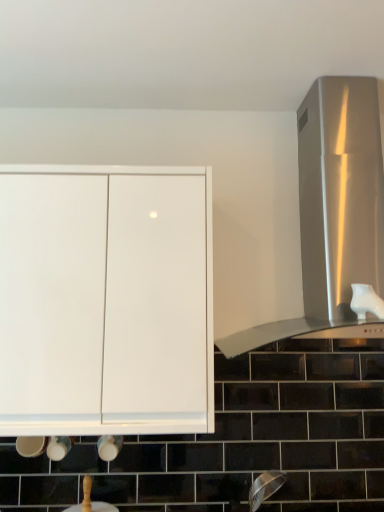
What do you see at coordinates (106, 300) in the screenshot?
I see `white glossy cabinet at upper left` at bounding box center [106, 300].

The width and height of the screenshot is (384, 512). Describe the element at coordinates (333, 209) in the screenshot. I see `stainless steel vent at right` at that location.

This screenshot has height=512, width=384. I want to click on white glossy sink at lower center, so click(90, 501).

Is white glossy sink at lower center touching white glossy cabinet at upper left?

No, white glossy sink at lower center is not next to white glossy cabinet at upper left.

Where is `sink on the right of white glossy cabinet at upper left`? sink on the right of white glossy cabinet at upper left is located at coordinates (90, 501).

Does white glossy sink at lower center have a greater height compared to white glossy cabinet at upper left?

No.

From the image's perspective, which is above, white glossy sink at lower center or white glossy cabinet at upper left?

white glossy cabinet at upper left, from the image's perspective.

Looking at this image, does stainless steel vent at right touch white glossy cabinet at upper left?

stainless steel vent at right and white glossy cabinet at upper left are clearly separated.

Identify the location of cabinetry below the stainless steel vent at right (from a real-world perspective). (106, 300).

Is point (282, 329) positioned behind point (120, 210)?

Yes, it is behind point (120, 210).

In the scene shown: Considering the relative sizes of stainless steel vent at right and white glossy cabinet at upper left in the image provided, is stainless steel vent at right taller than white glossy cabinet at upper left?

Yes.

Measure the distance from white glossy cabinet at upper left to stainless steel vent at right.

55.59 centimeters.

Is white glossy cabinet at upper left in contact with stainless steel vent at right?

white glossy cabinet at upper left and stainless steel vent at right are not in contact.

From a real-world perspective, is white glossy cabinet at upper left under stainless steel vent at right?

Yes, from a real-world perspective, white glossy cabinet at upper left is under stainless steel vent at right.

Between white glossy cabinet at upper left and stainless steel vent at right, which one is positioned behind?

stainless steel vent at right is further from the camera.

What's the angular difference between stainless steel vent at right and white glossy sink at lower center's facing directions?

The angle between the facing direction of stainless steel vent at right and the facing direction of white glossy sink at lower center is 3.52 degrees.

Does point (341, 106) come farther from viewer compared to point (83, 499)?

No, (341, 106) is closer to viewer.

How far apart are stainless steel vent at right and white glossy sink at lower center?

stainless steel vent at right is 3.89 feet away from white glossy sink at lower center.

From a real-world perspective, is stainless steel vent at right positioned over white glossy sink at lower center based on gravity?

Yes, from a real-world perspective, stainless steel vent at right is above white glossy sink at lower center.

From a real-world perspective, is white glossy cabinet at upper left located beneath white glossy sink at lower center?

No, from a real-world perspective, white glossy cabinet at upper left is not beneath white glossy sink at lower center.

From the image's perspective, is white glossy cabinet at upper left above or below white glossy sink at lower center?

white glossy cabinet at upper left is above white glossy sink at lower center.

Between point (94, 378) and point (90, 496), which one is positioned behind?

The point (90, 496) is more distant.

Is white glossy cabinet at upper left positioned beyond the bounds of white glossy sink at lower center?

Absolutely, white glossy cabinet at upper left is external to white glossy sink at lower center.

Between white glossy sink at lower center and stainless steel vent at right, which one has more height?

stainless steel vent at right is taller.

Is white glossy sink at lower center not within stainless steel vent at right?

Yes, white glossy sink at lower center is located beyond the bounds of stainless steel vent at right.

Does white glossy sink at lower center come in front of stainless steel vent at right?

No, white glossy sink at lower center is further to the viewer.

Are white glossy sink at lower center and stainless steel vent at right located far from each other?

Indeed, white glossy sink at lower center is not near stainless steel vent at right.

Locate an element on the screen. The width and height of the screenshot is (384, 512). cabinetry that appears on the left of white glossy sink at lower center is located at coordinates (106, 300).

At what (x,y) coordinates should I click in order to perform the action: click on cabinetry in front of the stainless steel vent at right. Please return your answer as a coordinate pair (x, y). Looking at the image, I should click on (106, 300).

Estimate the real-world distances between objects in this image. Which object is further from white glossy sink at lower center, white glossy cabinet at upper left or stainless steel vent at right?

stainless steel vent at right lies further to white glossy sink at lower center than the other object.

From the image, which object appears to be nearer to white glossy cabinet at upper left, white glossy sink at lower center or stainless steel vent at right?

stainless steel vent at right is positioned closer to the anchor white glossy cabinet at upper left.

Estimate the real-world distances between objects in this image. Which object is closer to white glossy sink at lower center, stainless steel vent at right or white glossy cabinet at upper left?

A: white glossy cabinet at upper left lies closer to white glossy sink at lower center than the other object.

Based on their spatial positions, is white glossy cabinet at upper left or white glossy sink at lower center further from stainless steel vent at right?

Among the two, white glossy sink at lower center is located further to stainless steel vent at right.

When comparing their distances from white glossy cabinet at upper left, does stainless steel vent at right or white glossy sink at lower center seem closer?

stainless steel vent at right.

Estimate the real-world distances between objects in this image. Which object is closer to stainless steel vent at right, white glossy sink at lower center or white glossy cabinet at upper left?

white glossy cabinet at upper left lies closer to stainless steel vent at right than the other object.

You are a GUI agent. You are given a task and a screenshot of the screen. Output one action in this format:
    pyautogui.click(x=<x>, y=<y>)
    Task: Click on the cabinetry between stainless steel vent at right and white glossy sink at lower center from top to bottom
    
    Given the screenshot: What is the action you would take?
    pyautogui.click(x=106, y=300)